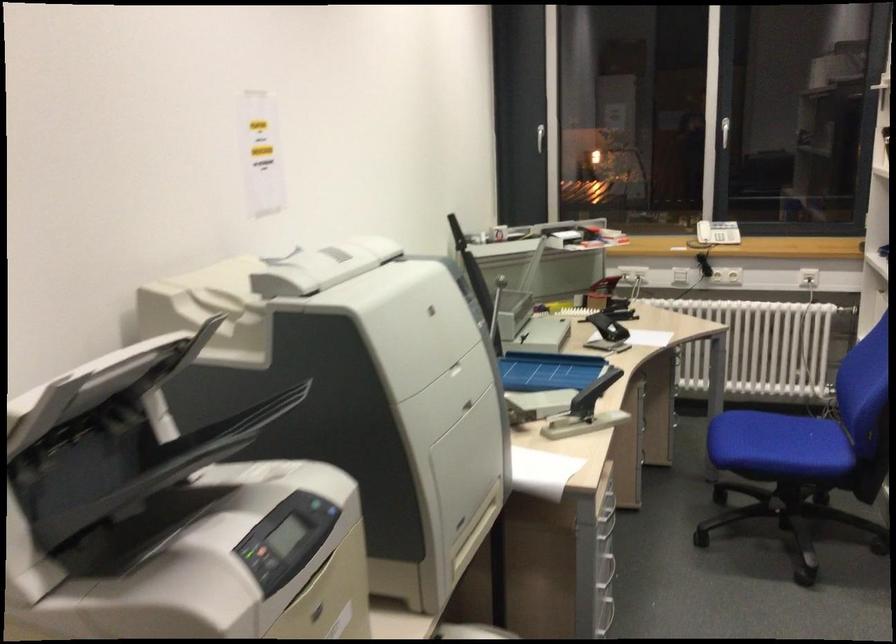
At what (x,y) coordinates should I click in order to perform the action: click on paper cutter handle. Please return your answer as a coordinate pair (x, y). This screenshot has width=896, height=644. Looking at the image, I should click on (489, 290).